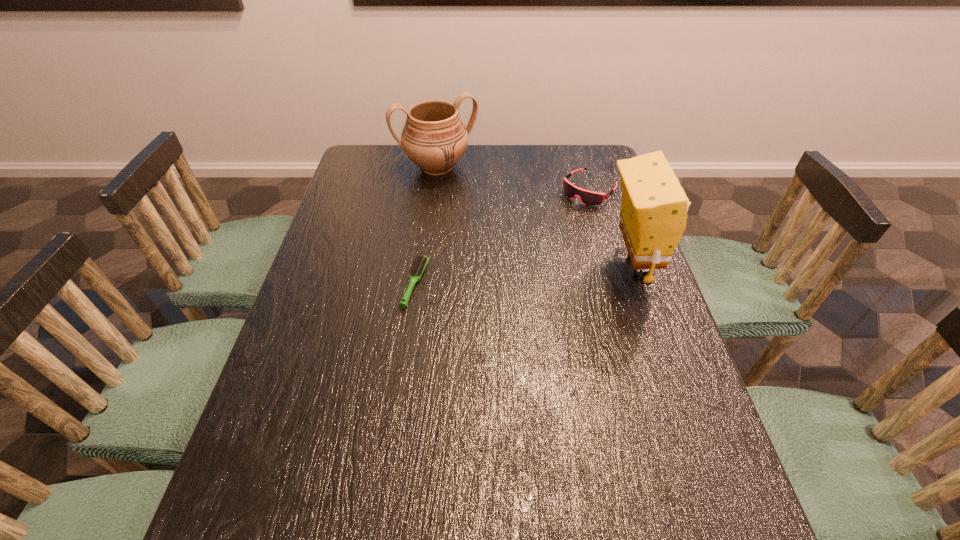
In the image, there is a desktop. At what (x,y) coordinates should I click in order to perform the action: click on free space at the left edge. Please return your answer as a coordinate pair (x, y). Looking at the image, I should click on (310, 330).

The width and height of the screenshot is (960, 540). In the image, there is a desktop. In order to click on vacant space at the right edge in this screenshot , I will do `click(648, 293)`.

At what (x,y) coordinates should I click in order to perform the action: click on free space at the far left corner of the desktop. Please return your answer as a coordinate pair (x, y). Image resolution: width=960 pixels, height=540 pixels. Looking at the image, I should click on (372, 145).

The image size is (960, 540). I want to click on free space between the third tallest object and the shortest object, so click(x=502, y=237).

The height and width of the screenshot is (540, 960). What are the coordinates of `vacant point located between the shortest object and the tallest object` in the screenshot? It's located at (524, 275).

At what (x,y) coordinates should I click in order to perform the action: click on vacant point located between the goggles and the tallest object. Please return your answer as a coordinate pair (x, y). This screenshot has height=540, width=960. Looking at the image, I should click on 612,228.

I want to click on vacant space that's between the shortest object and the tallest object, so click(524, 275).

The height and width of the screenshot is (540, 960). Find the location of `vacant space in between the second tallest object and the third tallest object`. vacant space in between the second tallest object and the third tallest object is located at coordinates (514, 178).

The width and height of the screenshot is (960, 540). What are the coordinates of `vacant space that's between the tallest object and the hairbrush` in the screenshot? It's located at (524, 275).

Identify the location of unoccupied position between the goggles and the sponge. (612, 228).